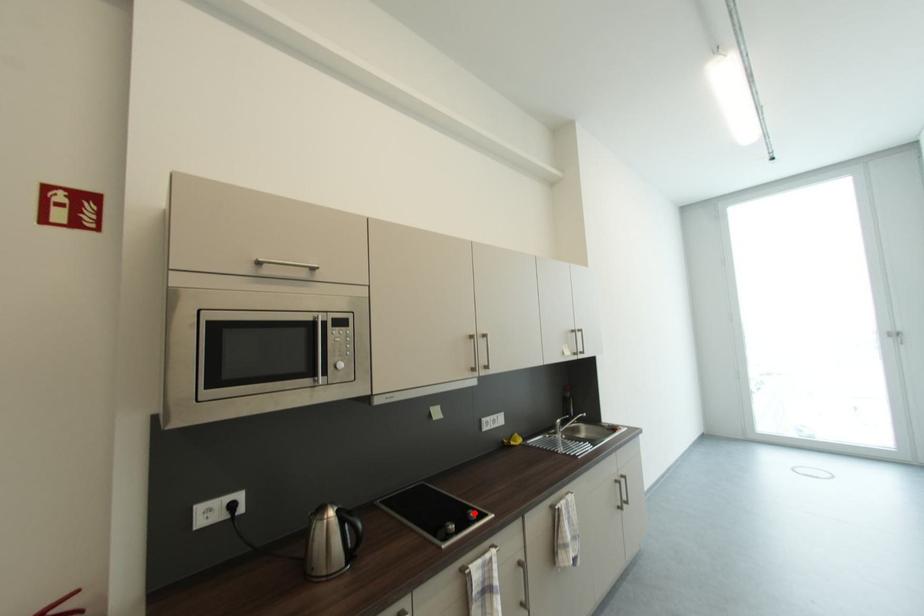
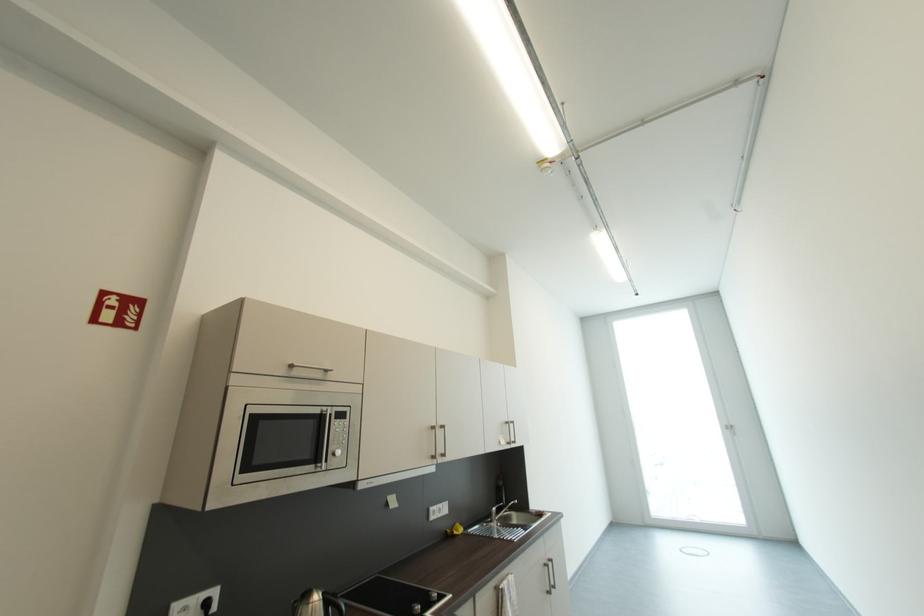
Where in the second image is the point corresponding to the highlighted location from the first image?

(435, 594)